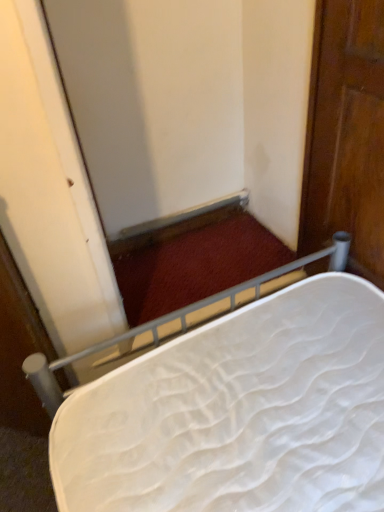
The image size is (384, 512). What do you see at coordinates (230, 405) in the screenshot?
I see `white textured mattress at lower center` at bounding box center [230, 405].

Image resolution: width=384 pixels, height=512 pixels. Find the location of `white textured mattress at lower center`. white textured mattress at lower center is located at coordinates (230, 405).

Locate an element on the screen. Image resolution: width=384 pixels, height=512 pixels. white textured mattress at lower center is located at coordinates (230, 405).